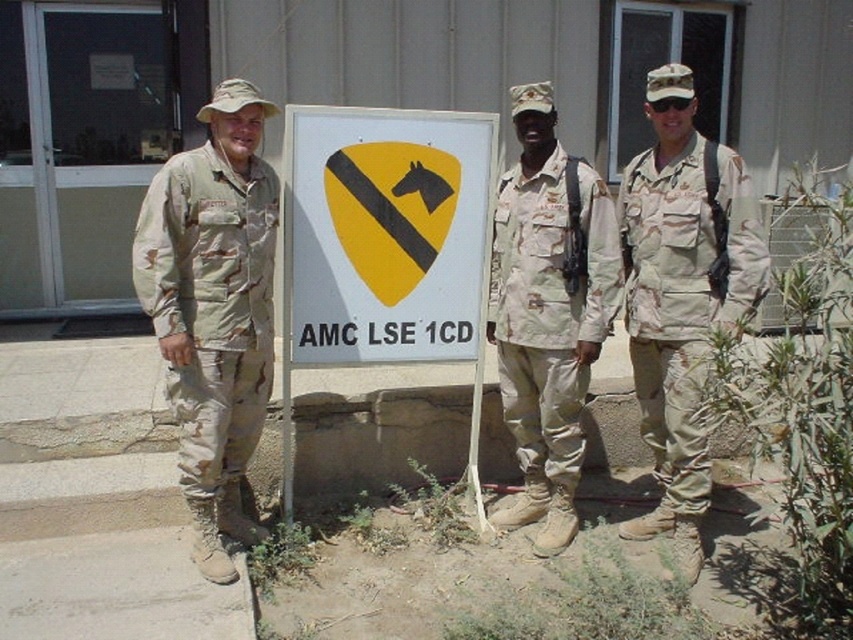
Question: Considering the real-world distances, which object is closest to the yellowmattesign at center?

Choices:
 (A) camouflage fabric uniform at right
 (B) camouflage uniform at center
 (C) camouflage fabric uniform at center
 (D) camouflage fabric uniform at left

Answer: (C)

Question: Does yellowmattesign at center appear under camouflage uniform at center?

Choices:
 (A) yes
 (B) no

Answer: (B)

Question: Which is farther from the camouflage fabric uniform at left?

Choices:
 (A) yellowmattesign at center
 (B) camouflage fabric uniform at center
 (C) camouflage fabric uniform at right
 (D) camouflage uniform at center

Answer: (D)

Question: Is camouflage uniform at center positioned at the back of camouflage fabric uniform at center?

Choices:
 (A) yes
 (B) no

Answer: (B)

Question: Considering the real-world distances, which object is farthest from the camouflage fabric uniform at center?

Choices:
 (A) camouflage uniform at center
 (B) yellowmattesign at center
 (C) camouflage fabric uniform at right
 (D) camouflage fabric uniform at left

Answer: (D)

Question: Can you confirm if yellowmattesign at center is bigger than camouflage uniform at center?

Choices:
 (A) yes
 (B) no

Answer: (B)